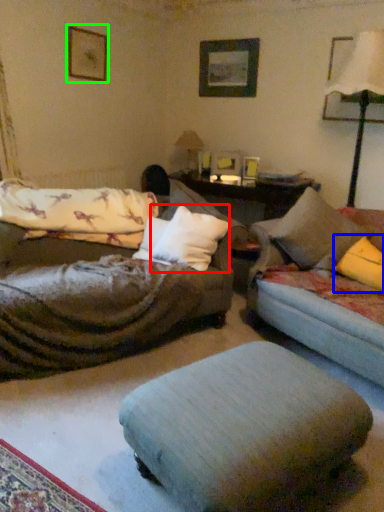
Question: Estimate the real-world distances between objects in this image. Which object is closer to throw pillow (highlighted by a red box), pillow (highlighted by a blue box) or picture frame (highlighted by a green box)?

Choices:
 (A) pillow
 (B) picture frame

Answer: (A)